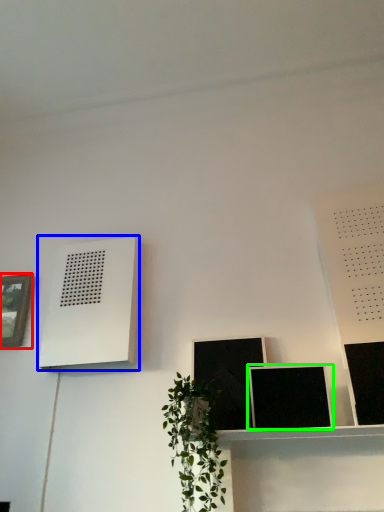
Question: Which object is positioned farthest from picture frame (highlighted by a red box)? Select from air conditioner (highlighted by a blue box) and picture frame (highlighted by a green box).

Choices:
 (A) air conditioner
 (B) picture frame

Answer: (B)